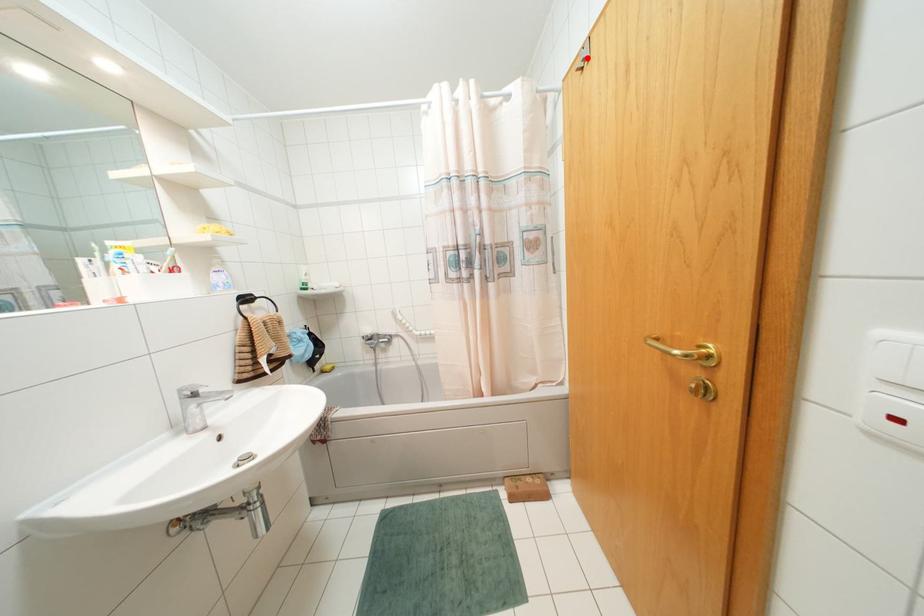
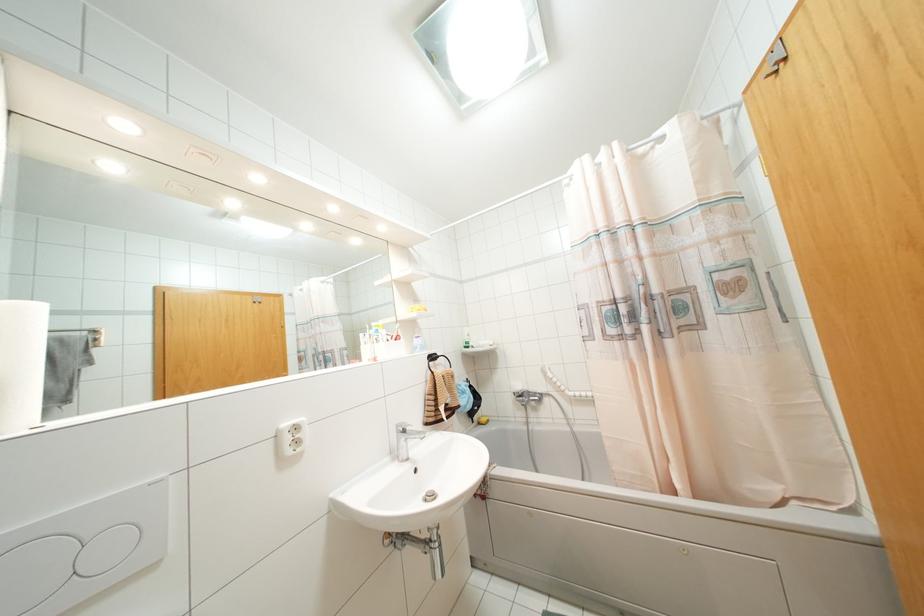
Where in the second image is the point corresponding to the highlighted location from the first image?

(784, 58)